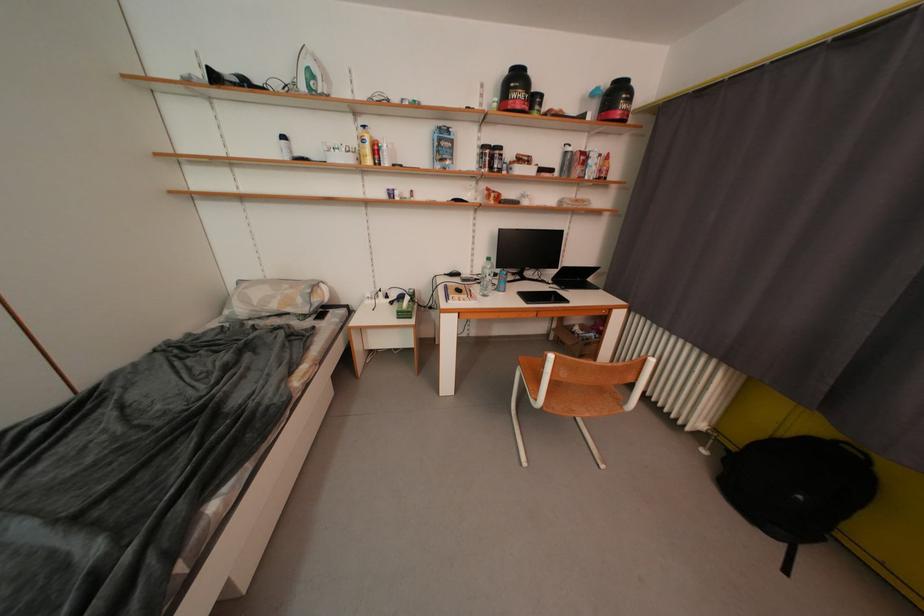
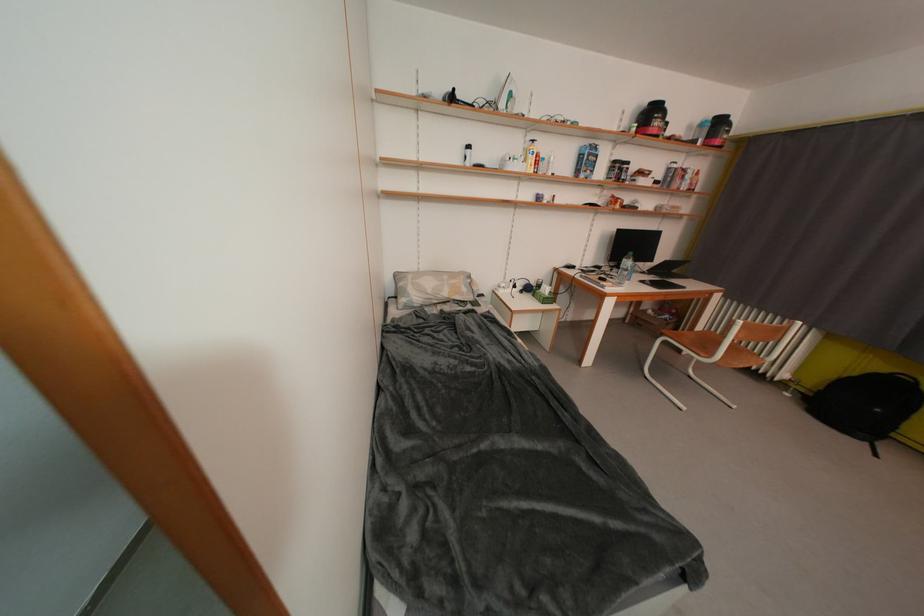
The point at (526, 110) is marked in the first image. Where is the corresponding point in the second image?

(663, 136)